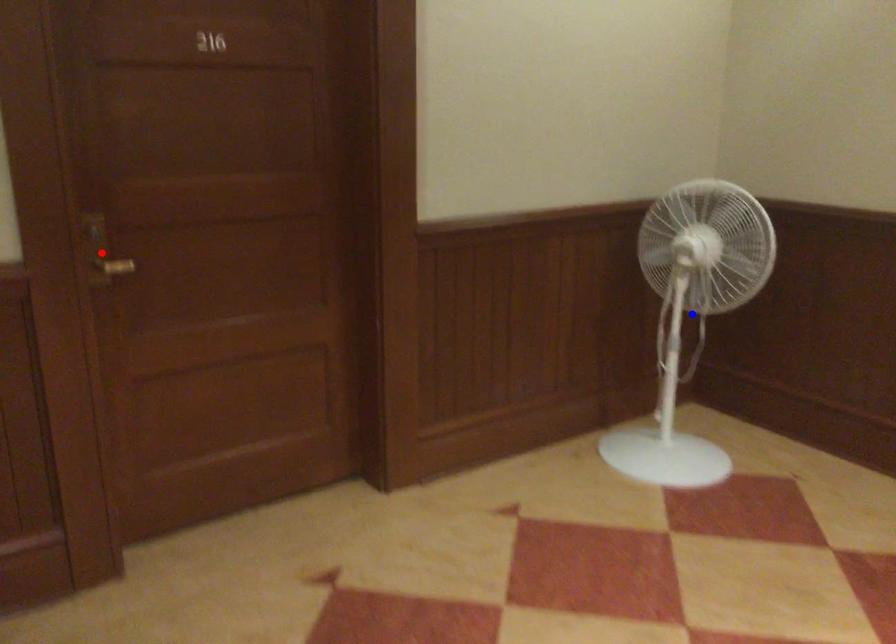
Question: Which of the two points in the image is closer to the camera?

Choices:
 (A) Blue point is closer.
 (B) Red point is closer.

Answer: (B)